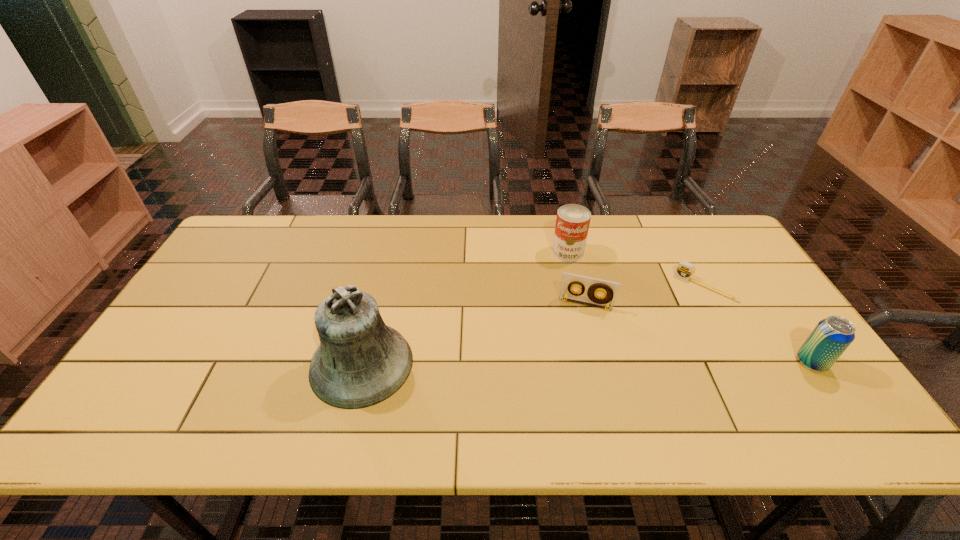
Find the location of a particular element. This screenshot has width=960, height=540. bell is located at coordinates (360, 362).

Identify the location of the leftmost object. This screenshot has width=960, height=540. (360, 362).

The height and width of the screenshot is (540, 960). Find the location of `the rightmost object`. the rightmost object is located at coordinates (832, 336).

Locate an element on the screen. can is located at coordinates (572, 223).

Where is `the fourth tallest object`? The width and height of the screenshot is (960, 540). the fourth tallest object is located at coordinates (609, 289).

I want to click on the shortest object, so click(685, 270).

Image resolution: width=960 pixels, height=540 pixels. I want to click on the fourth object from left to right, so click(x=685, y=270).

What are the coordinates of `vacant space located on the left of the bell` in the screenshot? It's located at pos(222,364).

At what (x,y) coordinates should I click in order to perform the action: click on free space located 0.270m on the back of the rightmost object. Please return your answer as a coordinate pair (x, y). Image resolution: width=960 pixels, height=540 pixels. Looking at the image, I should click on [x=755, y=280].

At what (x,y) coordinates should I click in order to perform the action: click on vacant space located on the front label of the farthest object. Please return your answer as a coordinate pair (x, y). The width and height of the screenshot is (960, 540). Looking at the image, I should click on (552, 298).